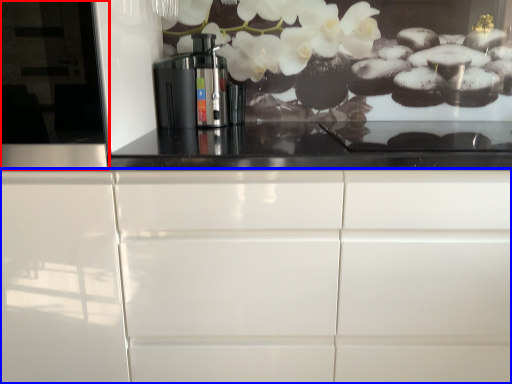
Question: Which point is closer to the camera, glass door (highlighted by a red box) or cabinetry (highlighted by a blue box)?

Choices:
 (A) glass door
 (B) cabinetry

Answer: (A)